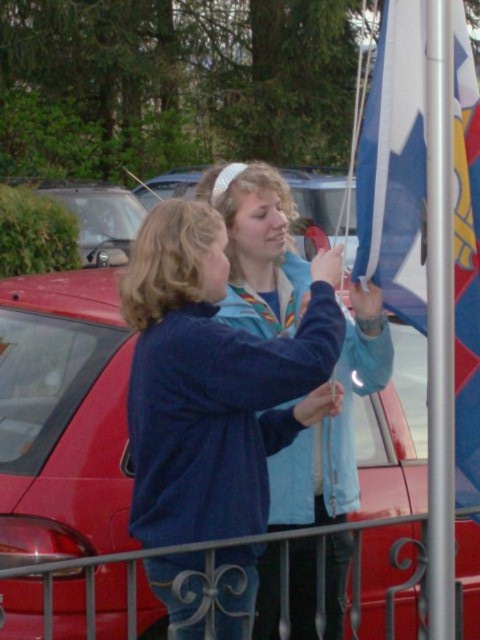
Does metallic red car at center appear on the left side of blue fabric flag at right?

Correct, you'll find metallic red car at center to the left of blue fabric flag at right.

Can you confirm if metallic red car at center is taller than blue fabric flag at right?

No, metallic red car at center is not taller than blue fabric flag at right.

Between point (44, 493) and point (417, 72), which one is positioned behind?

The point (44, 493) is behind.

Find the location of `metallic red car at center`. metallic red car at center is located at coordinates (62, 417).

Who is more forward, (10,552) or (224,218)?

Positioned in front is point (224,218).

Can you confirm if metallic red car at center is positioned above blue fleece jacket at center?

Yes, metallic red car at center is above blue fleece jacket at center.

The height and width of the screenshot is (640, 480). What do you see at coordinates (62, 417) in the screenshot?
I see `metallic red car at center` at bounding box center [62, 417].

The width and height of the screenshot is (480, 640). I want to click on metallic red car at center, so click(x=62, y=417).

Who is more distant from viewer, [262,282] or [456,369]?

The point [262,282] is behind.

Is point (300, 580) farther from camera compared to point (418, 266)?

Yes, point (300, 580) is behind point (418, 266).

Find the location of a particular element. blue fleece jacket at center is located at coordinates (333, 428).